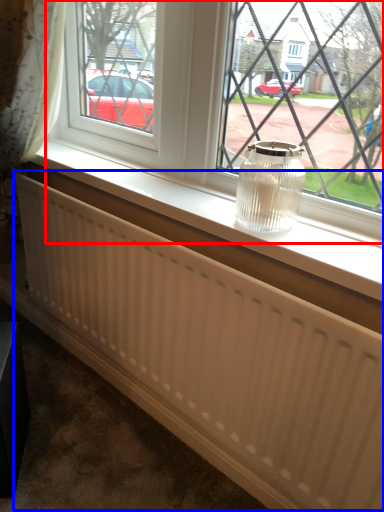
Question: Which of the following is the closest to the observer, window (highlighted by a red box) or radiator (highlighted by a blue box)?

Choices:
 (A) window
 (B) radiator

Answer: (A)